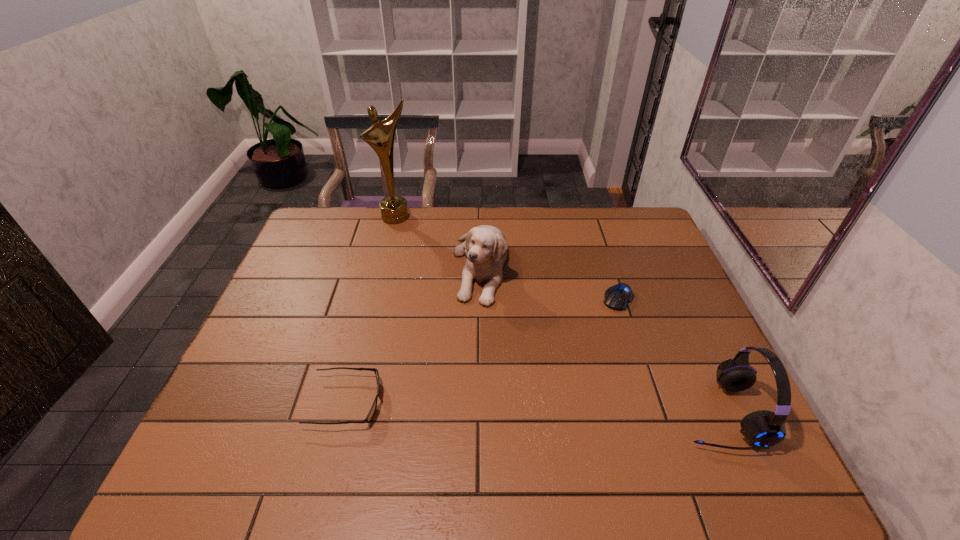
You are a GUI agent. You are given a task and a screenshot of the screen. Output one action in this format:
    pyautogui.click(x=<x>, y=<y>)
    Task: Click on the fourth tallest object
    
    Given the screenshot: What is the action you would take?
    pyautogui.click(x=371, y=413)

At what (x,y) coordinates should I click in order to perform the action: click on headset. Please return your answer as a coordinate pair (x, y). The height and width of the screenshot is (540, 960). Looking at the image, I should click on (763, 429).

At what (x,y) coordinates should I click in order to perform the action: click on the third object from left to right. Please return your answer as a coordinate pair (x, y). The image size is (960, 540). Looking at the image, I should click on (485, 246).

Image resolution: width=960 pixels, height=540 pixels. Find the location of `the tallest object`. the tallest object is located at coordinates (380, 136).

I want to click on the farthest object, so click(380, 136).

Where is `the second object from right to left`? Image resolution: width=960 pixels, height=540 pixels. the second object from right to left is located at coordinates (617, 297).

Locate an element on the screen. This screenshot has height=540, width=960. the shortest object is located at coordinates (617, 297).

Identify the location of vacant region located on the front-facing side of the second shortest object. (537, 402).

I want to click on vacant position located on the ear cushions of the headset, so click(656, 413).

You are a GUI agent. You are given a task and a screenshot of the screen. Output one action in this format:
    pyautogui.click(x=<x>, y=<y>)
    Task: Click on the blank space located on the ear cushions of the headset
    The image size is (960, 540).
    Given the screenshot: What is the action you would take?
    pyautogui.click(x=613, y=413)